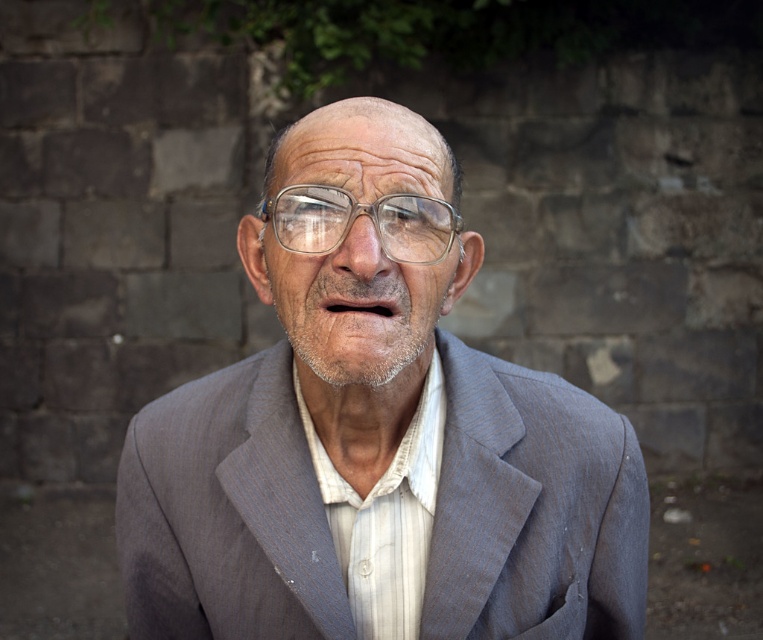
Question: Among these points, which one is nearest to the camera?

Choices:
 (A) (288, 236)
 (B) (401, 608)

Answer: (A)

Question: Can you confirm if gray textured suit at center is thinner than transparent plastic glasses at center?

Choices:
 (A) yes
 (B) no

Answer: (B)

Question: Which point is closer to the camera?

Choices:
 (A) gray textured suit at center
 (B) transparent plastic glasses at center

Answer: (A)

Question: Can you confirm if gray textured suit at center is positioned above transparent plastic glasses at center?

Choices:
 (A) yes
 (B) no

Answer: (B)

Question: Can you confirm if gray textured suit at center is positioned above transparent plastic glasses at center?

Choices:
 (A) yes
 (B) no

Answer: (B)

Question: Which of the following is the closest to the observer?

Choices:
 (A) transparent plastic glasses at center
 (B) gray textured suit at center

Answer: (B)